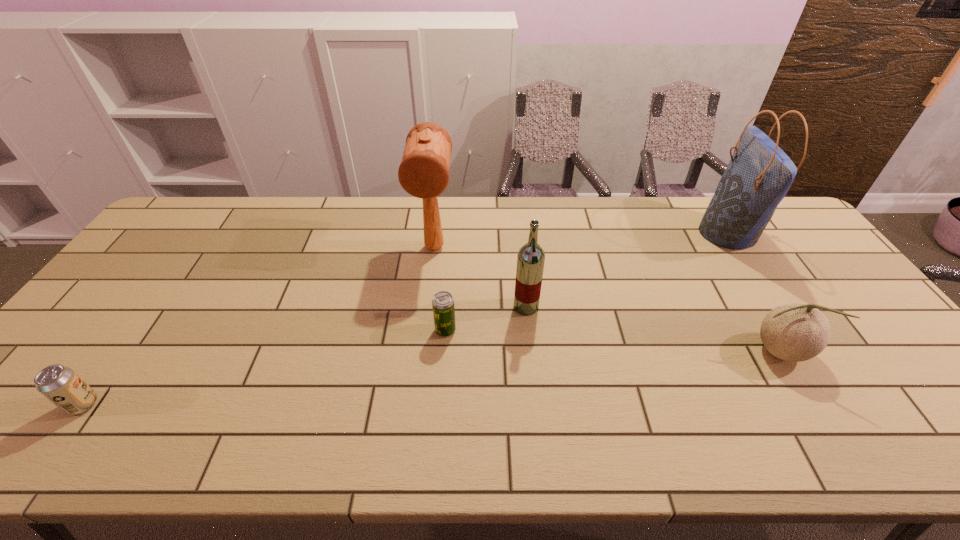
Find the location of a particular element. free spot that satisfies the following two spatial constraints: 1. on the back side of the liquor; 2. on the right side of the farther beer can is located at coordinates (447, 307).